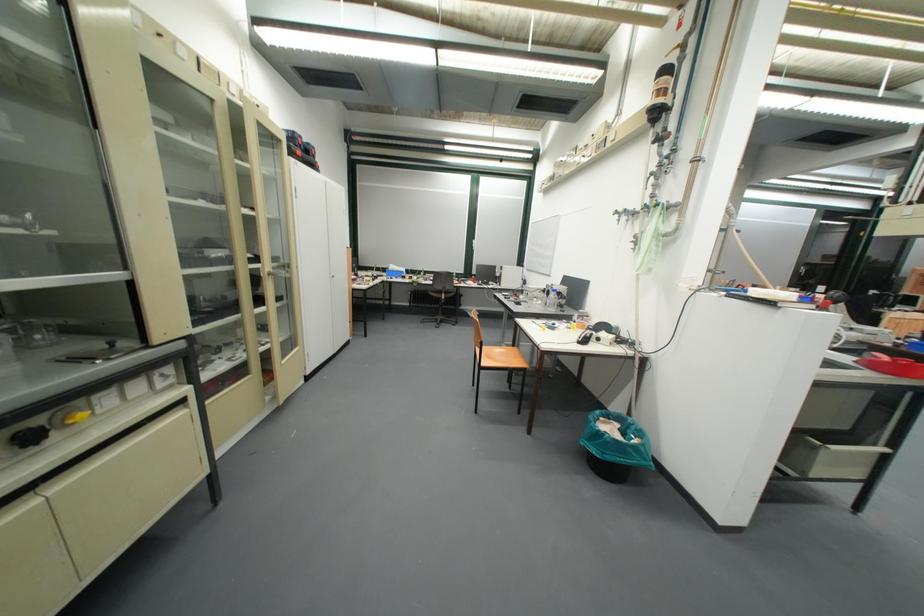
The image size is (924, 616). What are the coordinates of `blue and black toolbox` in the screenshot? It's located at click(x=300, y=148).